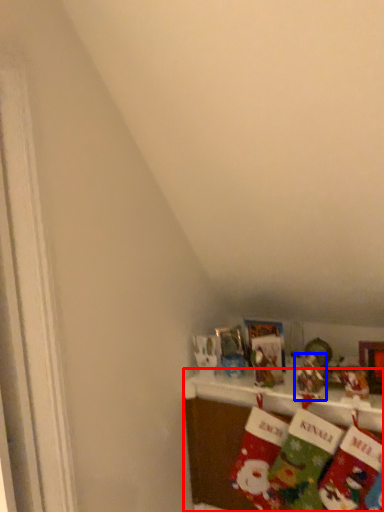
Question: Which point is closer to the camera, shelf (highlighted by a red box) or toy (highlighted by a blue box)?

Choices:
 (A) shelf
 (B) toy

Answer: (A)